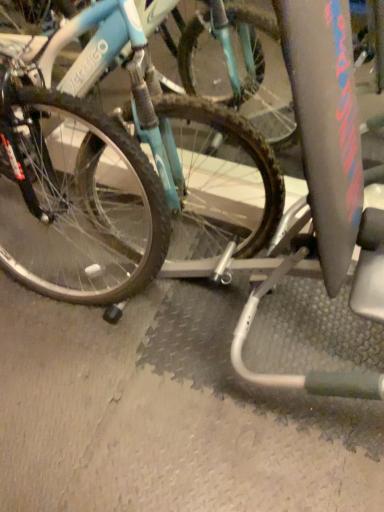
This screenshot has height=512, width=384. Describe the element at coordinates (87, 92) in the screenshot. I see `matte black tire at center` at that location.

You are a GUI agent. You are given a task and a screenshot of the screen. Output one action in this format:
    pyautogui.click(x=<x>, y=<y>)
    Task: Click on the matte black tire at center
    This screenshot has height=512, width=384.
    Given the screenshot: What is the action you would take?
    pyautogui.click(x=87, y=92)

Locate an element on the screen. This screenshot has height=512, width=384. matte black tire at center is located at coordinates (87, 92).